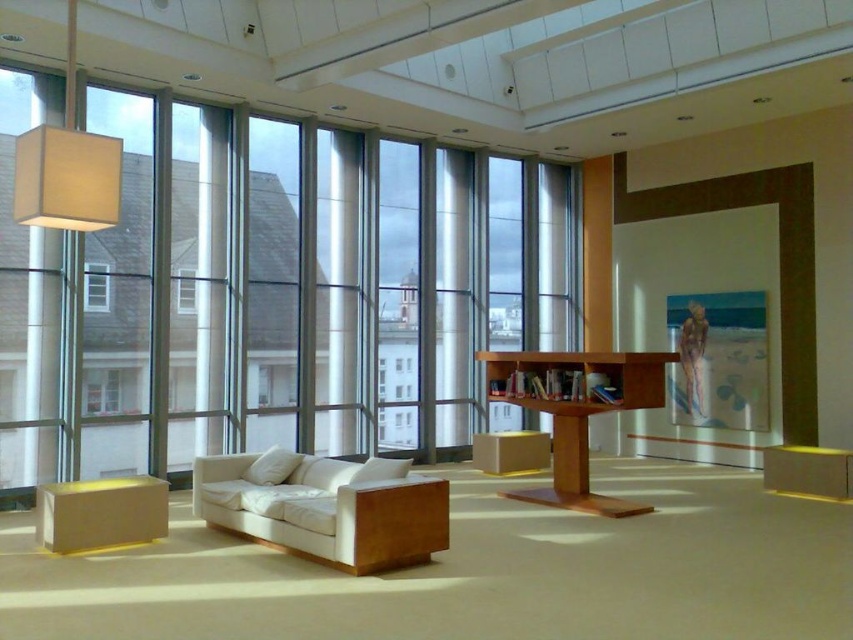
Question: Among these points, which one is nearest to the camera?

Choices:
 (A) (97, 308)
 (B) (93, 540)
 (C) (566, 376)

Answer: (B)

Question: Does white fabric lampshade at upper left appear over clear glass window at center?

Choices:
 (A) yes
 (B) no

Answer: (A)

Question: Estimate the real-world distances between objects in this image. Which object is closer to the matte wood bookshelf at center?

Choices:
 (A) clear glass window at left
 (B) clear glass window at center
 (C) white leather couch at center
 (D) white fabric lampshade at upper left

Answer: (C)

Question: Is light brown wooden bookshelf at center bigger than matte white coffee table at lower left?

Choices:
 (A) no
 (B) yes

Answer: (B)

Question: Which of the following is the closest to the observer?

Choices:
 (A) matte white coffee table at lower left
 (B) clear glass window at center
 (C) light brown wooden bookshelf at center

Answer: (A)

Question: Is white leather couch at center above clear glass window at center?

Choices:
 (A) yes
 (B) no

Answer: (B)